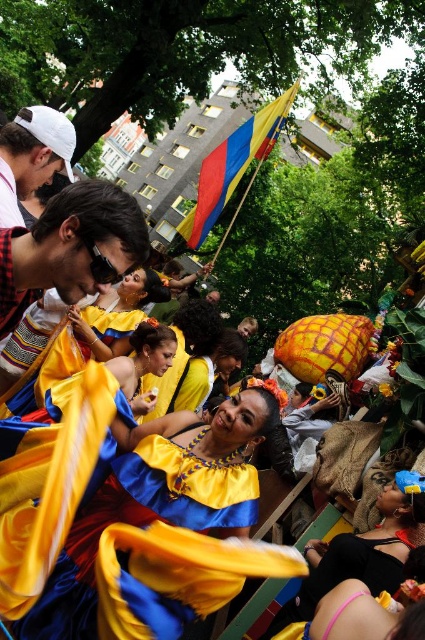
Does yellow and blue fabric flag at upper center lie behind black satin bikini at lower right?

That is True.

Is point (238, 148) farther from viewer compared to point (331, 582)?

Yes, it is.

Measure the distance between yellow and blue fabric flag at upper center and camera.

A distance of 76.25 meters exists between yellow and blue fabric flag at upper center and camera.

Where is `yellow and blue fabric flag at upper center`? Image resolution: width=425 pixels, height=640 pixels. yellow and blue fabric flag at upper center is located at coordinates (232, 168).

Describe the element at coordinates (141, 520) in the screenshot. I see `shiny satin dress at center` at that location.

Who is more distant from viewer, (189, 500) or (238, 150)?

The point (238, 150) is more distant.

What do you see at coordinates (141, 520) in the screenshot? The width and height of the screenshot is (425, 640). I see `shiny satin dress at center` at bounding box center [141, 520].

This screenshot has height=640, width=425. In order to click on shiny satin dress at center in this screenshot , I will do `click(141, 520)`.

Between black satin bikini at lower right and white matte cap at upper left, which one is positioned higher?

white matte cap at upper left is higher up.

Which of these two, black satin bikini at lower right or white matte cap at upper left, stands shorter?

Standing shorter between the two is black satin bikini at lower right.

Locate an element on the screen. black satin bikini at lower right is located at coordinates coord(345,573).